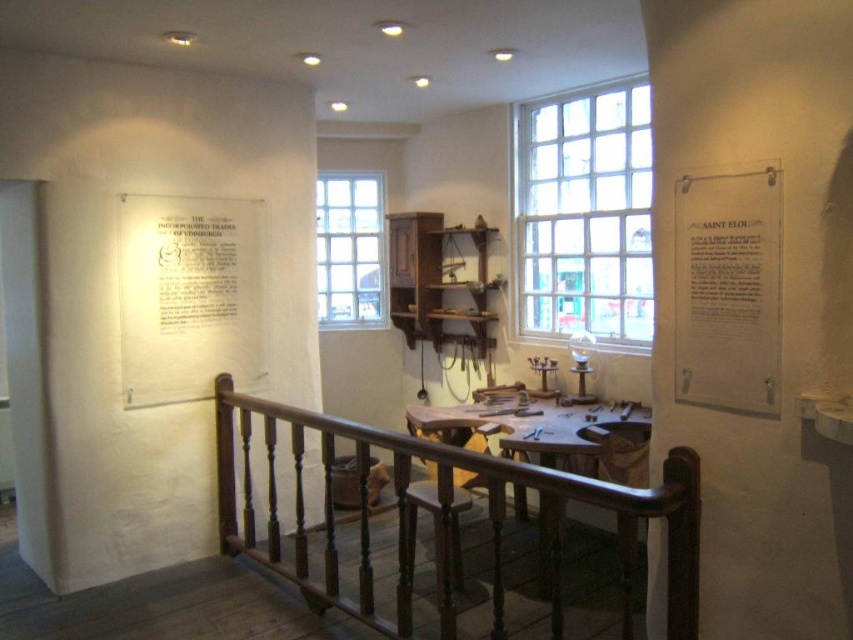
You are standing in the museum and want to locate the white paper at upper left. According to the coordinates provided, where should you look relative to the mounted plaque on the left wall?

The white paper at upper left is located at coordinates point (189, 296), which is to the right of the mounted plaque on the left wall.

You are a visitor in the museum and you see the dark wood railing at center and the white paper at upper left. Which object is located to the right of the other?

The dark wood railing at center is located to the right of the white paper at upper left.